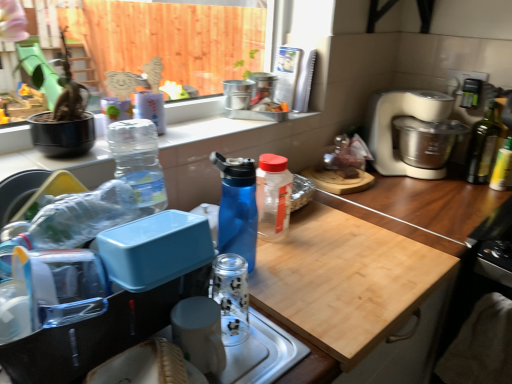
Question: Should I look upward or downward to see translucent plastic bag at upper right?

Choices:
 (A) up
 (B) down

Answer: (A)

Question: Should I look upward or downward to see metallic silver canisters at upper center, the first appliance from the right?

Choices:
 (A) up
 (B) down

Answer: (A)

Question: From a real-world perspective, is wooden cutting board at center on transparent glass bottle at lower center, the first bottle positioned from the front?

Choices:
 (A) yes
 (B) no

Answer: (A)

Question: Is wooden cutting board at center taller than transparent glass bottle at lower center, the first bottle positioned from the front?

Choices:
 (A) no
 (B) yes

Answer: (B)

Question: Is wooden cutting board at center smaller than transparent glass bottle at lower center, the 2th bottle viewed from the left?

Choices:
 (A) no
 (B) yes

Answer: (A)

Question: Could you tell me if wooden cutting board at center is turned towards transparent glass bottle at lower center, the first bottle positioned from the front?

Choices:
 (A) no
 (B) yes

Answer: (B)

Question: From a real-world perspective, is wooden cutting board at center below transparent glass bottle at lower center, the fifth bottle viewed from the back?

Choices:
 (A) no
 (B) yes

Answer: (A)

Question: Considering the relative positions of wooden cutting board at center and transparent glass bottle at lower center, the fifth bottle viewed from the back, in the image provided, is wooden cutting board at center to the right of transparent glass bottle at lower center, the fifth bottle viewed from the back, from the viewer's perspective?

Choices:
 (A) yes
 (B) no

Answer: (A)

Question: Is metallic silver canisters at upper center, the 2th appliance when ordered from front to back, positioned far away from dark green glass bottle at right, the 4th bottle from the left?

Choices:
 (A) no
 (B) yes

Answer: (A)

Question: Can you confirm if metallic silver canisters at upper center, the first appliance from the right, is taller than dark green glass bottle at right, which is counted as the 2th bottle, starting from the right?

Choices:
 (A) no
 (B) yes

Answer: (A)

Question: Is metallic silver canisters at upper center, marked as the second appliance in a left-to-right arrangement, shorter than dark green glass bottle at right, the 1th bottle viewed from the back?

Choices:
 (A) yes
 (B) no

Answer: (A)

Question: Does metallic silver canisters at upper center, the 2th appliance when ordered from front to back, have a lesser width compared to dark green glass bottle at right, the 4th bottle from the left?

Choices:
 (A) no
 (B) yes

Answer: (A)

Question: Does metallic silver canisters at upper center, which is the first appliance in top-to-bottom order, have a smaller size compared to dark green glass bottle at right, the 4th bottle from the left?

Choices:
 (A) no
 (B) yes

Answer: (B)

Question: Is the position of metallic silver canisters at upper center, which appears as the second appliance when ordered from the bottom, less distant than that of dark green glass bottle at right, which is the 5th bottle from front to back?

Choices:
 (A) no
 (B) yes

Answer: (A)

Question: Considering the relative positions of wooden cutting board at center and metallic silver canisters at upper center, which appears as the 1th appliance when viewed from the back, in the image provided, is wooden cutting board at center to the left of metallic silver canisters at upper center, which appears as the 1th appliance when viewed from the back, from the viewer's perspective?

Choices:
 (A) no
 (B) yes

Answer: (A)